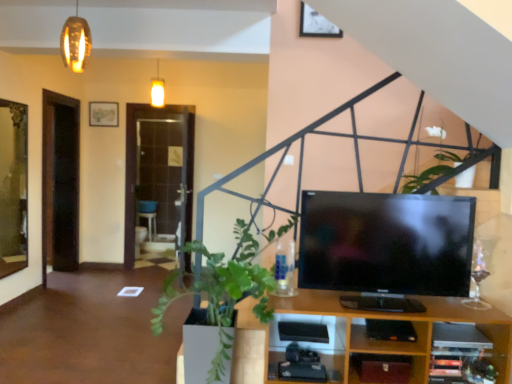
Question: Is green leafy plant at lower left turned away from white glossy flower at upper center?

Choices:
 (A) yes
 (B) no

Answer: (B)

Question: Is green leafy plant at lower left at the left side of white glossy flower at upper center?

Choices:
 (A) no
 (B) yes

Answer: (B)

Question: Is green leafy plant at lower left in contact with white glossy flower at upper center?

Choices:
 (A) yes
 (B) no

Answer: (B)

Question: Could you tell me if green leafy plant at lower left is turned towards white glossy flower at upper center?

Choices:
 (A) no
 (B) yes

Answer: (A)

Question: From the image's perspective, is green leafy plant at lower left below white glossy flower at upper center?

Choices:
 (A) yes
 (B) no

Answer: (A)

Question: In terms of size, does metallic silver picture frame at upper center appear bigger or smaller than white glossy flower at upper center?

Choices:
 (A) big
 (B) small

Answer: (B)

Question: In terms of height, does metallic silver picture frame at upper center look taller or shorter compared to white glossy flower at upper center?

Choices:
 (A) tall
 (B) short

Answer: (B)

Question: In the image, is metallic silver picture frame at upper center on the left side or the right side of white glossy flower at upper center?

Choices:
 (A) right
 (B) left

Answer: (B)

Question: Looking at their shapes, would you say metallic silver picture frame at upper center is wider or thinner than white glossy flower at upper center?

Choices:
 (A) thin
 (B) wide

Answer: (A)

Question: Considering the positions of point (307, 21) and point (243, 246), is point (307, 21) closer or farther from the camera than point (243, 246)?

Choices:
 (A) closer
 (B) farther

Answer: (B)

Question: Is metallic silver picture frame at upper center in front of or behind green leafy plant at lower left in the image?

Choices:
 (A) behind
 (B) front

Answer: (A)

Question: Looking at the image, does metallic silver picture frame at upper center seem bigger or smaller compared to green leafy plant at lower left?

Choices:
 (A) big
 (B) small

Answer: (B)

Question: Is metallic silver picture frame at upper center wider or thinner than green leafy plant at lower left?

Choices:
 (A) thin
 (B) wide

Answer: (A)

Question: From their relative heights in the image, would you say white glossy flower at upper center is taller or shorter than green leafy plant at lower left?

Choices:
 (A) tall
 (B) short

Answer: (B)

Question: Relative to green leafy plant at lower left, is white glossy flower at upper center in front or behind?

Choices:
 (A) behind
 (B) front

Answer: (A)